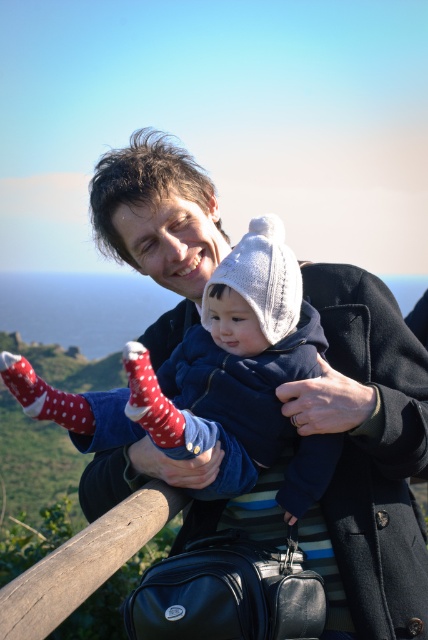
You are standing in the scene and see two points marked in the image. Which point is closer to you, point (88, 404) or point (172, 433)?

Point (88, 404) is closer to you because it is further to the viewer than point (172, 433).

You are a photographer trying to capture the child in the image. The child is wearing a navy blue jacket, a white knit hat, and red socks with white polka dots. The photographer wants to focus on the knitted woolen hat at center located at point (223, 369). To ensure the hat is in the center of the frame, should the photographer adjust the camera to the left or right? Please explain based on the given coordinates.

The knitted woolen hat at center is already located at point (223, 369). Since the coordinates are given as a point on the image plane, where the center is typically at 0.5, 0.5, the hat is slightly to the right and above the exact center. To center it perfectly, the photographer should adjust the camera slightly to the left and down.

You are a photographer trying to capture a closeup of the child in the scene. You notice the knitted woolen hat at center and the red dotted socks at lower left. Which object is closer to the camera, and why?

The knitted woolen hat at center is closer to the camera because it is positioned in front of the red dotted socks at lower left, meaning it appears nearer in the image.